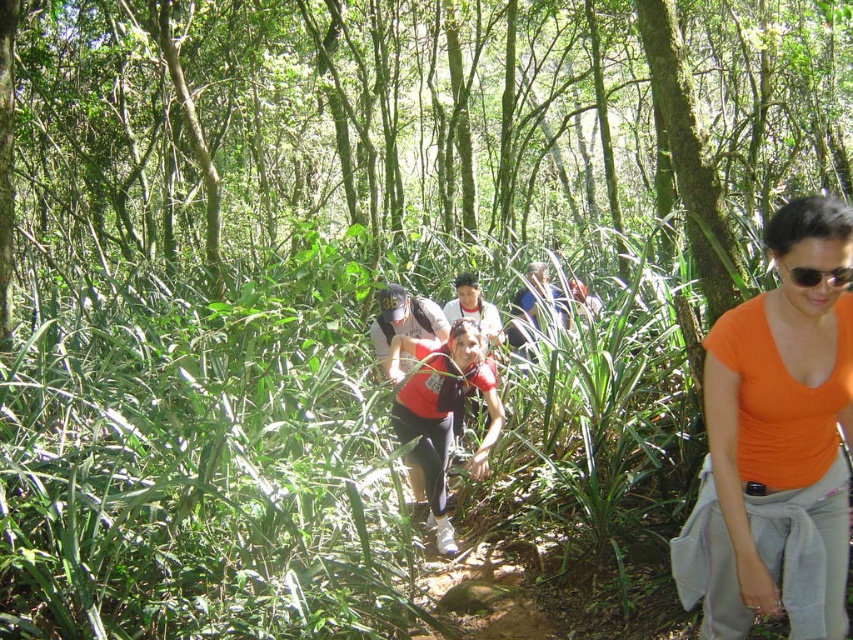
Does orange matte shirt at center have a lesser width compared to red matte shirt at center?

Correct, orange matte shirt at center's width is less than red matte shirt at center's.

Who is more distant from viewer, (749, 584) or (427, 365)?

Positioned behind is point (427, 365).

Which is behind, point (775, 472) or point (419, 433)?

Positioned behind is point (419, 433).

This screenshot has height=640, width=853. I want to click on orange matte shirt at center, so click(776, 445).

Looking at this image, how far apart are red matte shirt at center and black plastic sunglasses at right?

13.19 feet

Is point (399, 380) closer to camera compared to point (787, 266)?

No, (399, 380) is further to viewer.

Find the location of `red matte shirt at center`. red matte shirt at center is located at coordinates (440, 410).

Is point (747, 602) behind point (851, 280)?

Yes, point (747, 602) is farther from viewer.

Is point (720, 490) closer to viewer compared to point (809, 285)?

That is False.

Where is `orange matte shirt at center`? Image resolution: width=853 pixels, height=640 pixels. orange matte shirt at center is located at coordinates (776, 445).